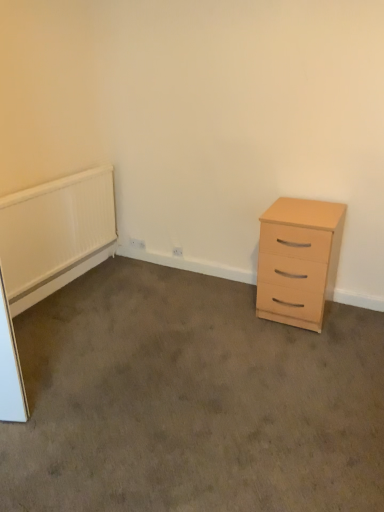
Question: From the image's perspective, is light wood/finish chest of drawers at right beneath light wood drawer at right?

Choices:
 (A) no
 (B) yes

Answer: (A)

Question: Is light wood drawer at right at the back of light wood/finish chest of drawers at right?

Choices:
 (A) no
 (B) yes

Answer: (A)

Question: Considering the relative sizes of light wood/finish chest of drawers at right and light wood drawer at right in the image provided, is light wood/finish chest of drawers at right smaller than light wood drawer at right?

Choices:
 (A) no
 (B) yes

Answer: (B)

Question: From a real-world perspective, is light wood/finish chest of drawers at right located higher than light wood drawer at right?

Choices:
 (A) no
 (B) yes

Answer: (B)

Question: Is light wood/finish chest of drawers at right aimed at light wood drawer at right?

Choices:
 (A) yes
 (B) no

Answer: (B)

Question: Is white plastic electric outlet at lower center to the left or to the right of white textured radiator at left in the image?

Choices:
 (A) left
 (B) right

Answer: (B)

Question: Is white plastic electric outlet at lower center inside the boundaries of white textured radiator at left, or outside?

Choices:
 (A) inside
 (B) outside

Answer: (B)

Question: Is point (182, 253) closer or farther from the camera than point (99, 184)?

Choices:
 (A) farther
 (B) closer

Answer: (A)

Question: In terms of width, does white plastic electric outlet at lower center look wider or thinner when compared to white textured radiator at left?

Choices:
 (A) thin
 (B) wide

Answer: (A)

Question: From a real-world perspective, is light wood/finish chest of drawers at right above or below light wood drawer at right?

Choices:
 (A) below
 (B) above

Answer: (B)

Question: Considering their positions, is light wood/finish chest of drawers at right located in front of or behind light wood drawer at right?

Choices:
 (A) front
 (B) behind

Answer: (B)

Question: In the image, is light wood/finish chest of drawers at right on the left side or the right side of light wood drawer at right?

Choices:
 (A) left
 (B) right

Answer: (B)

Question: Looking at their shapes, would you say light wood/finish chest of drawers at right is wider or thinner than light wood drawer at right?

Choices:
 (A) thin
 (B) wide

Answer: (A)

Question: Is white plastic electric outlet at lower center to the left or to the right of light wood/finish chest of drawers at right in the image?

Choices:
 (A) right
 (B) left

Answer: (B)

Question: Is white plastic electric outlet at lower center in front of or behind light wood/finish chest of drawers at right in the image?

Choices:
 (A) behind
 (B) front

Answer: (A)